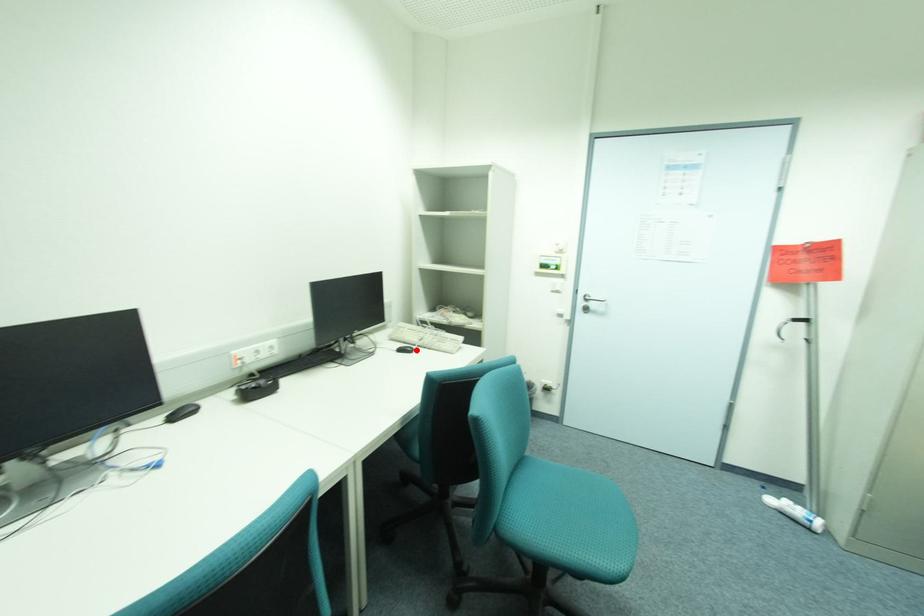
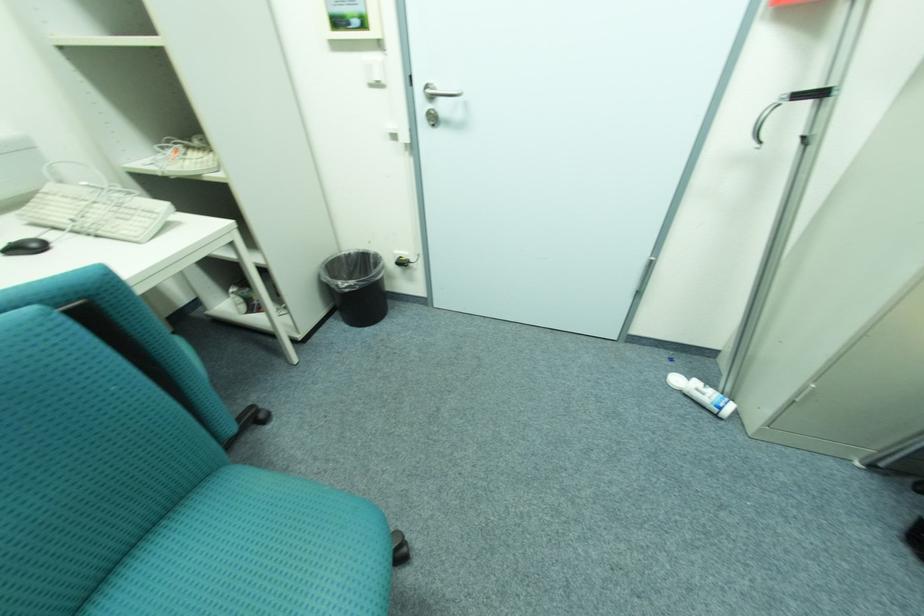
Locate, in the second image, the point that corresponds to the highlighted location in the first image.

(43, 246)